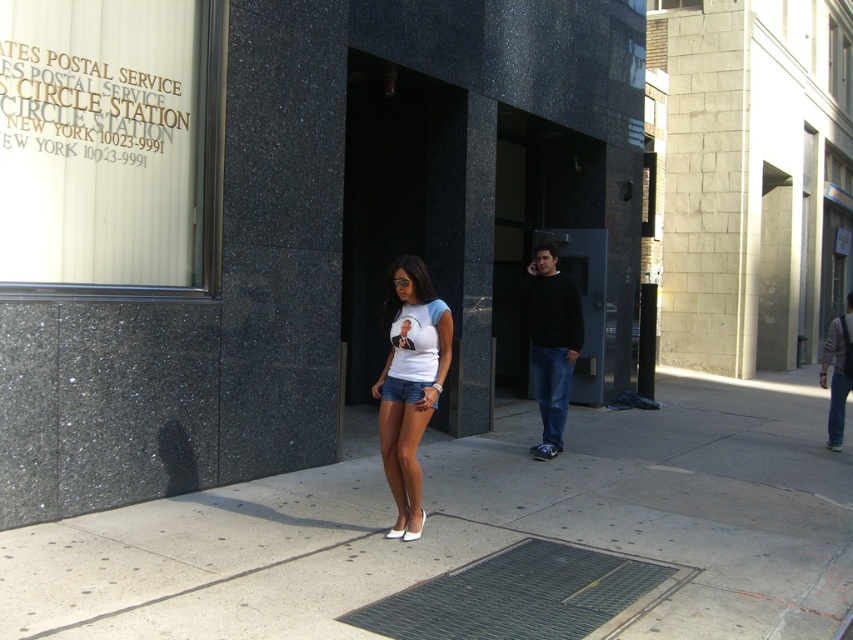
You are a delivery person who needs to hand a package to the recipient. You see the black cotton sweater at center and denim jeans at right. Which object is closer to the left side of the image?

The black cotton sweater at center is closer to the left side of the image than the denim jeans at right.